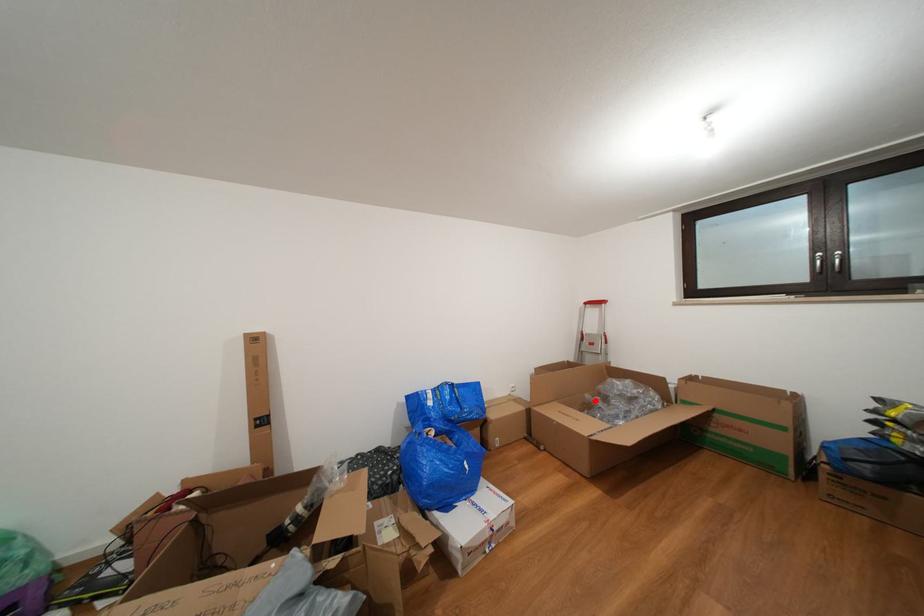
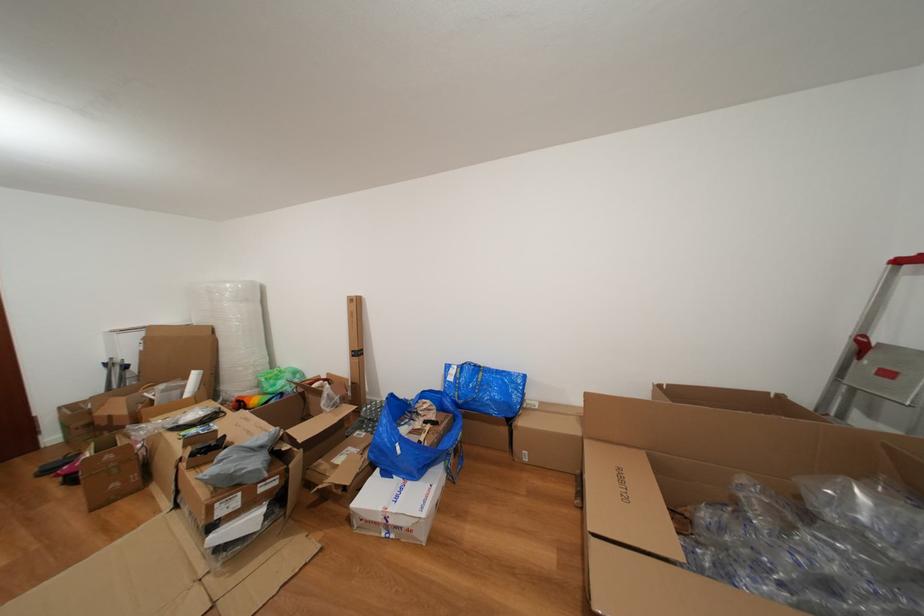
Where in the second image is the point corresponding to the highlighted location from the first image?

(750, 485)